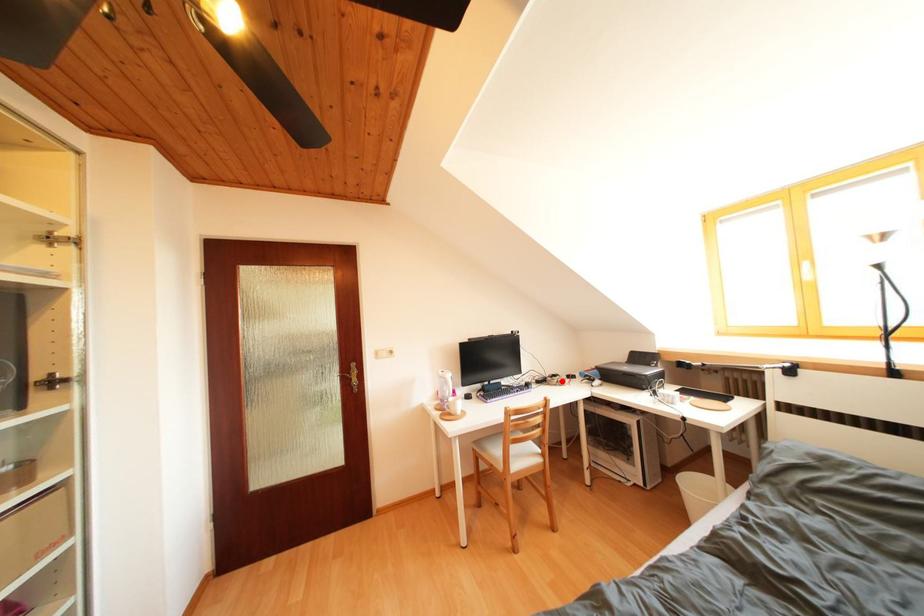
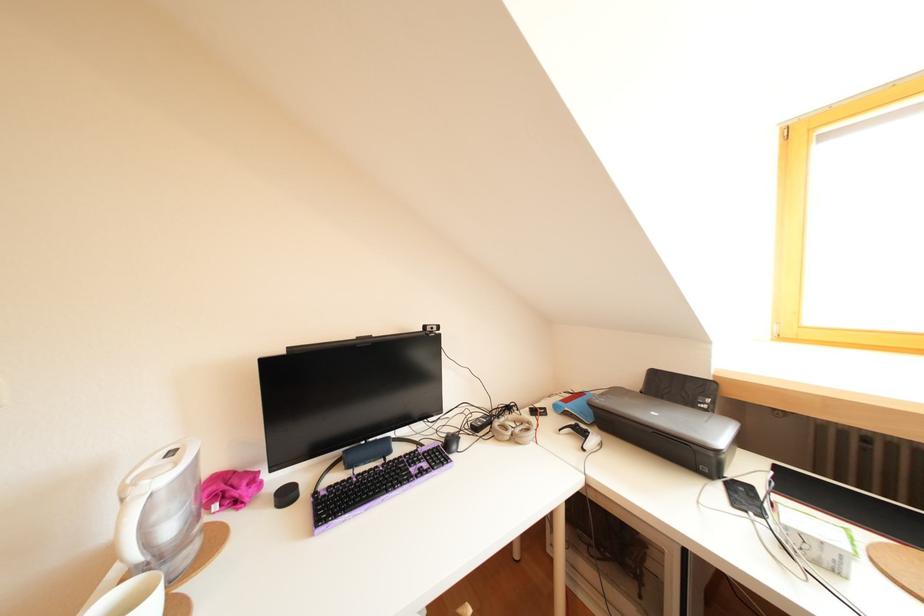
In the second image, find the point that corresponds to the highlighted location in the first image.

(516, 413)